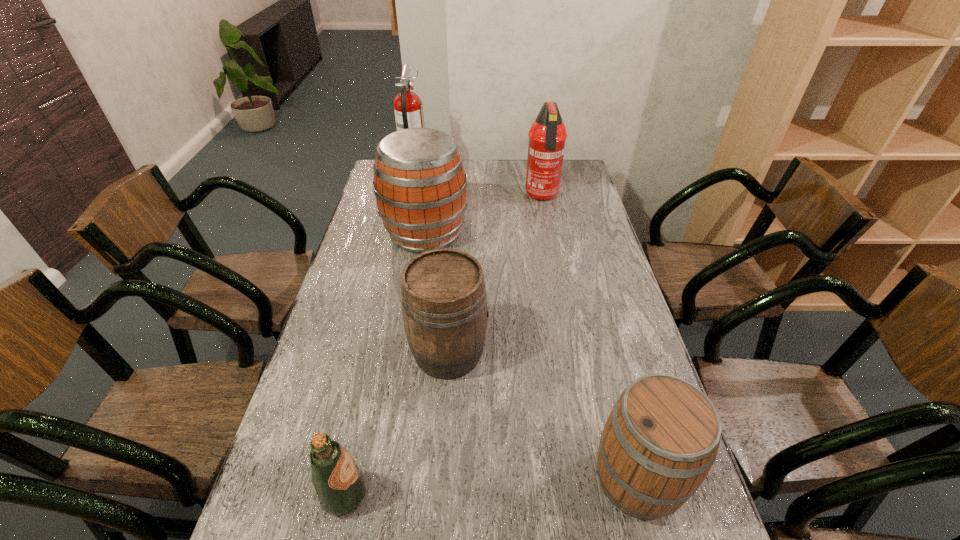
The width and height of the screenshot is (960, 540). I want to click on vacant space located on the trigger side of the fifth nearest object, so click(549, 233).

I want to click on vacant space located 0.130m on the front of the fourth nearest object, so click(418, 287).

Locate an element on the screen. vacant space situated 0.300m on the side of the second farthest cider near the bung hole is located at coordinates (596, 353).

Where is `free space located 0.310m on the left of the rightmost cider`? free space located 0.310m on the left of the rightmost cider is located at coordinates (450, 480).

Identify the location of vacant space situated on the front-facing side of the olive oil. The width and height of the screenshot is (960, 540). (537, 495).

You are a GUI agent. You are given a task and a screenshot of the screen. Output one action in this format:
    pyautogui.click(x=<x>, y=<y>)
    Task: Click on the fire extinguisher present at the left edge
    Image resolution: width=960 pixels, height=540 pixels.
    Given the screenshot: What is the action you would take?
    pyautogui.click(x=408, y=108)

This screenshot has height=540, width=960. What are the coordinates of `cider that is positioned at the left edge` in the screenshot? It's located at (420, 186).

This screenshot has height=540, width=960. What are the coordinates of `olive oil located at the left edge` in the screenshot? It's located at (339, 483).

At what (x,y) coordinates should I click in order to perform the action: click on fire extinguisher located at the right edge. Please return your answer as a coordinate pair (x, y). This screenshot has width=960, height=540. Looking at the image, I should click on (547, 135).

This screenshot has width=960, height=540. In order to click on cider present at the right edge in this screenshot , I will do `click(661, 439)`.